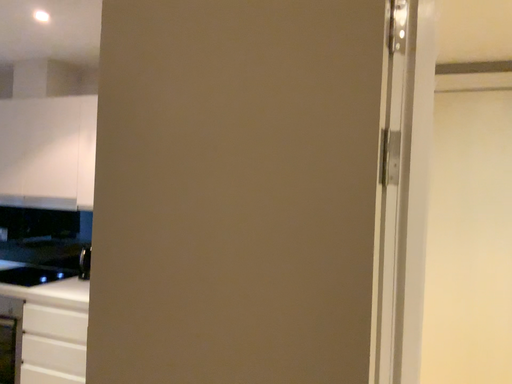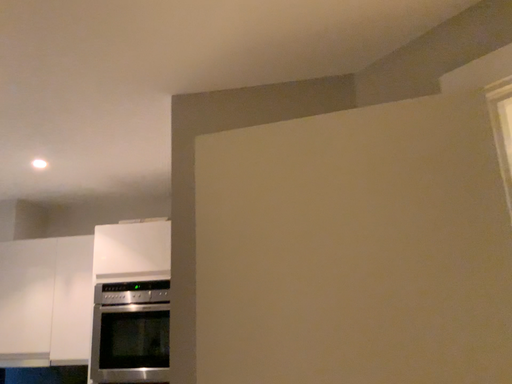
Question: Which way did the camera rotate in the video?

Choices:
 (A) rotated left
 (B) rotated right

Answer: (B)